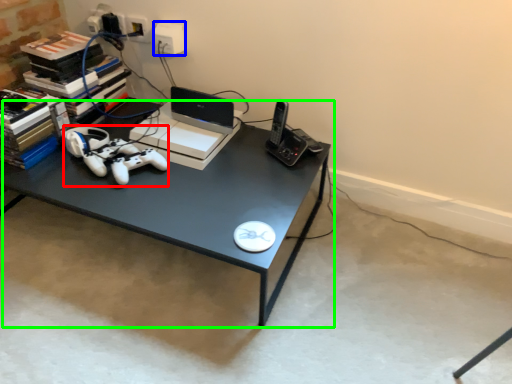
Question: Which is nearer to the game controller (highlighted by a red box)? electric outlet (highlighted by a blue box) or desk (highlighted by a green box).

Choices:
 (A) electric outlet
 (B) desk

Answer: (B)